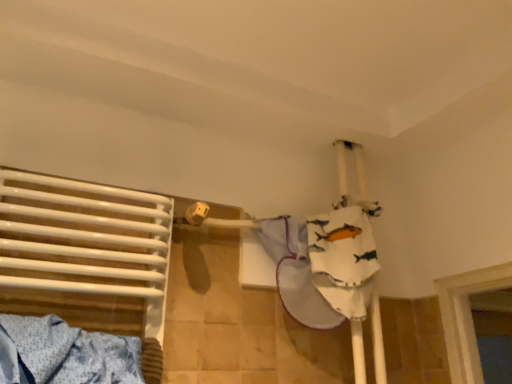
Question: Is white cotton cloth at upper right smaller than white glossy towel at left?

Choices:
 (A) no
 (B) yes

Answer: (B)

Question: Considering the relative sizes of white cotton cloth at upper right and white glossy towel at left in the image provided, is white cotton cloth at upper right taller than white glossy towel at left?

Choices:
 (A) no
 (B) yes

Answer: (A)

Question: From a real-world perspective, is white cotton cloth at upper right on top of white glossy towel at left?

Choices:
 (A) no
 (B) yes

Answer: (B)

Question: Is white glossy towel at left inside white cotton cloth at upper right?

Choices:
 (A) yes
 (B) no

Answer: (B)

Question: Can we say white cotton cloth at upper right lies outside white glossy towel at left?

Choices:
 (A) yes
 (B) no

Answer: (A)

Question: From the image's perspective, is white cotton cloth at upper right located above white glossy towel at left?

Choices:
 (A) yes
 (B) no

Answer: (B)

Question: Is white glossy towel at left not close to white cotton cloth at upper right?

Choices:
 (A) no
 (B) yes

Answer: (A)

Question: Considering the relative sizes of white glossy towel at left and white cotton cloth at upper right in the image provided, is white glossy towel at left wider than white cotton cloth at upper right?

Choices:
 (A) yes
 (B) no

Answer: (B)

Question: Considering the relative sizes of white glossy towel at left and white cotton cloth at upper right in the image provided, is white glossy towel at left bigger than white cotton cloth at upper right?

Choices:
 (A) yes
 (B) no

Answer: (A)

Question: Would you say white glossy towel at left contains white cotton cloth at upper right?

Choices:
 (A) no
 (B) yes

Answer: (A)

Question: Considering the relative positions of white glossy towel at left and white cotton cloth at upper right in the image provided, is white glossy towel at left to the left of white cotton cloth at upper right from the viewer's perspective?

Choices:
 (A) yes
 (B) no

Answer: (A)

Question: From the image's perspective, is white glossy towel at left above white cotton cloth at upper right?

Choices:
 (A) yes
 (B) no

Answer: (A)

Question: From a real-world perspective, is white cotton cloth at upper right above or below white glossy towel at left?

Choices:
 (A) below
 (B) above

Answer: (B)